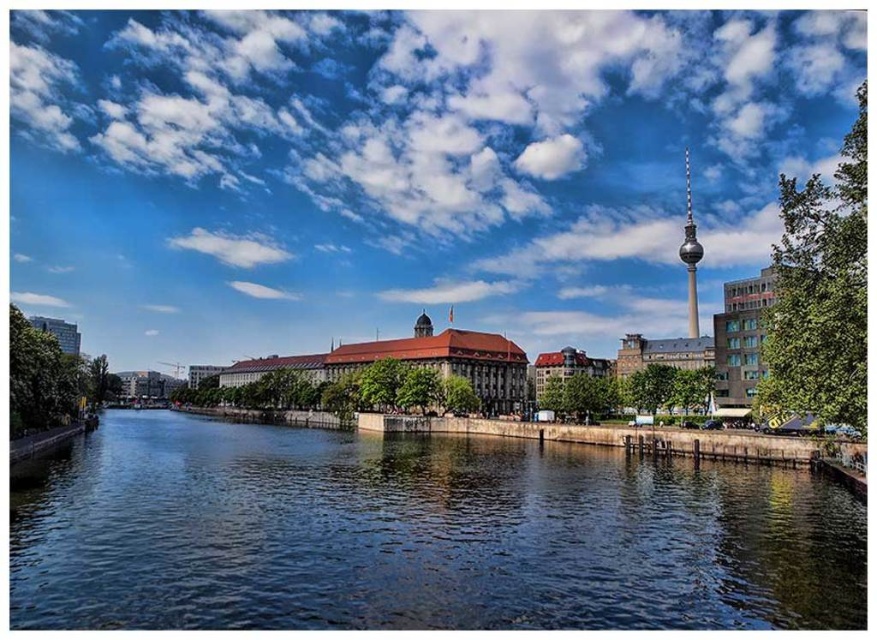
Question: Which point is closer to the camera taking this photo?

Choices:
 (A) (696, 300)
 (B) (100, 502)

Answer: (B)

Question: Is dark blue water at center positioned before shiny silver tower at upper center?

Choices:
 (A) yes
 (B) no

Answer: (A)

Question: In this image, where is dark blue water at center located relative to shiny silver tower at upper center?

Choices:
 (A) left
 (B) right

Answer: (A)

Question: Can you confirm if dark blue water at center is positioned to the right of shiny silver tower at upper center?

Choices:
 (A) yes
 (B) no

Answer: (B)